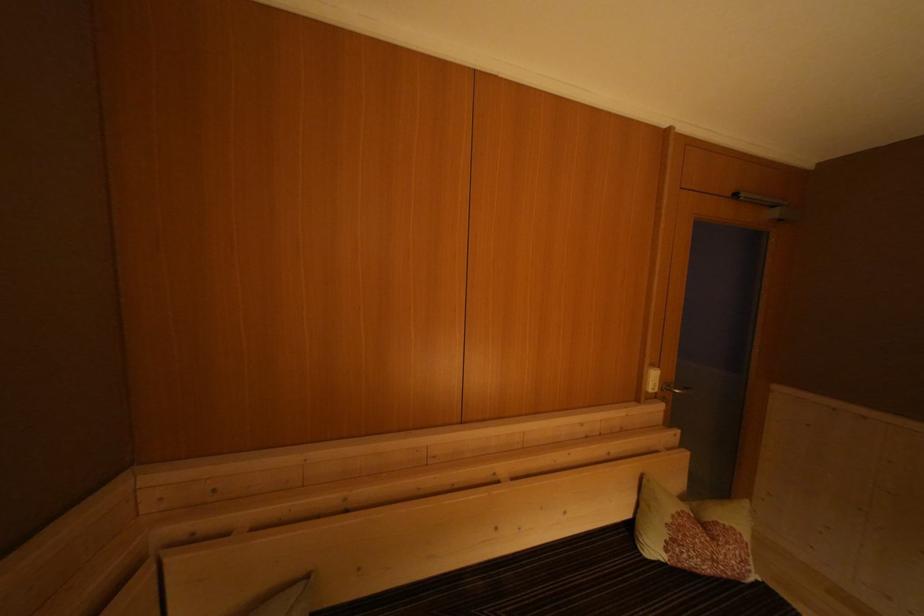
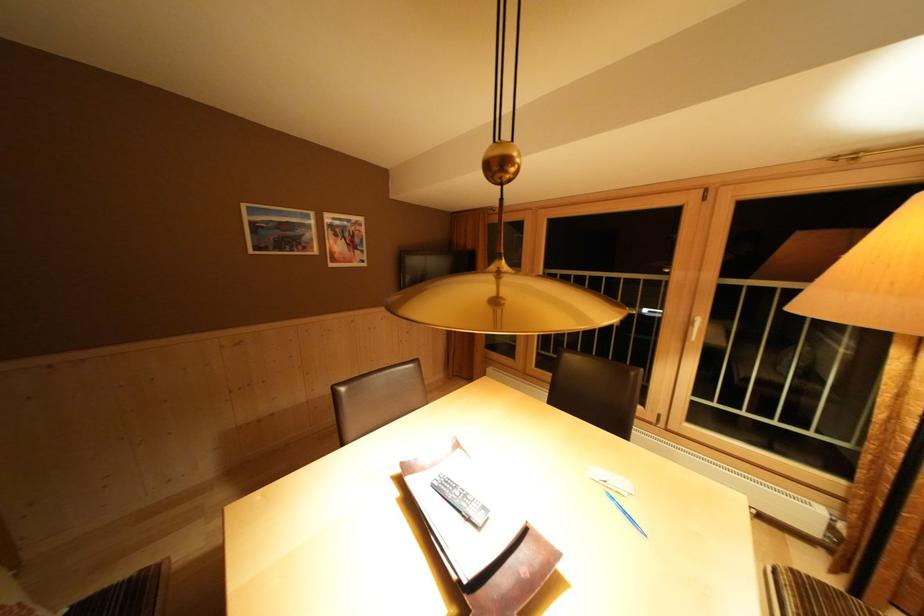
Based on the continuous images, in which direction is the camera rotating?

The camera's rotation is toward right-down.